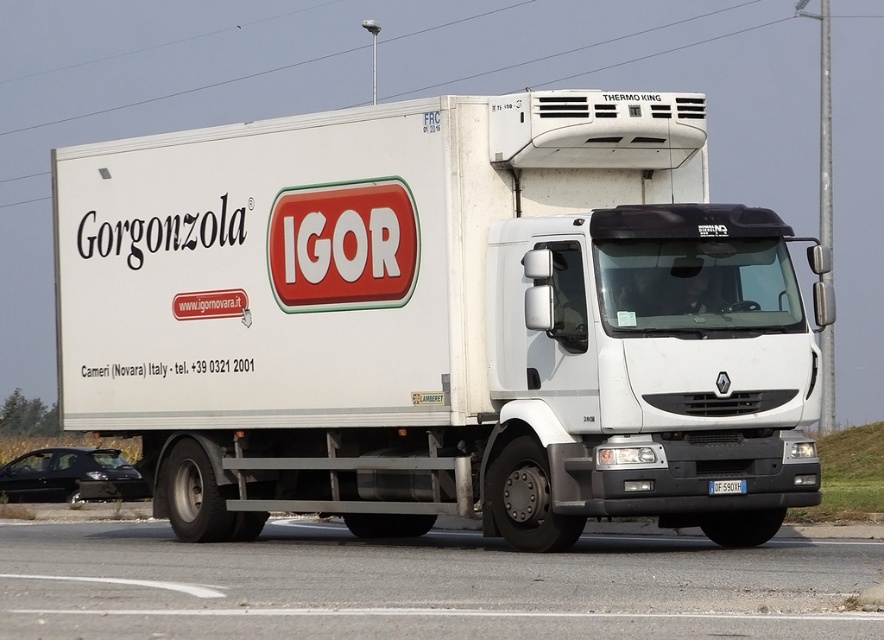
Question: Which point appears closest to the camera in this image?

Choices:
 (A) (34, 524)
 (B) (725, 483)
 (C) (210, 365)

Answer: (B)

Question: Is gray asphalt road at lower center smaller than white plastic license plate at center?

Choices:
 (A) yes
 (B) no

Answer: (B)

Question: Which object is positioned closest to the gray asphalt road at lower center?

Choices:
 (A) white matte trailer truck at center
 (B) white plastic license plate at center

Answer: (A)

Question: Is gray asphalt road at lower center closer to camera compared to white plastic license plate at center?

Choices:
 (A) yes
 (B) no

Answer: (A)

Question: Does white matte trailer truck at center have a larger size compared to white plastic license plate at center?

Choices:
 (A) yes
 (B) no

Answer: (A)

Question: Which of the following is the farthest from the observer?

Choices:
 (A) (436, 403)
 (B) (469, 595)

Answer: (A)